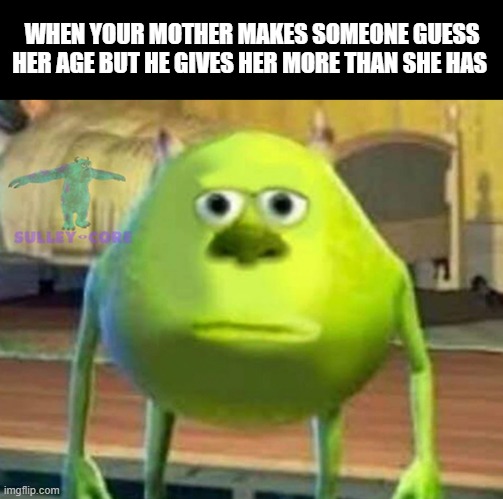
Identify the location of blanket. (93, 129).